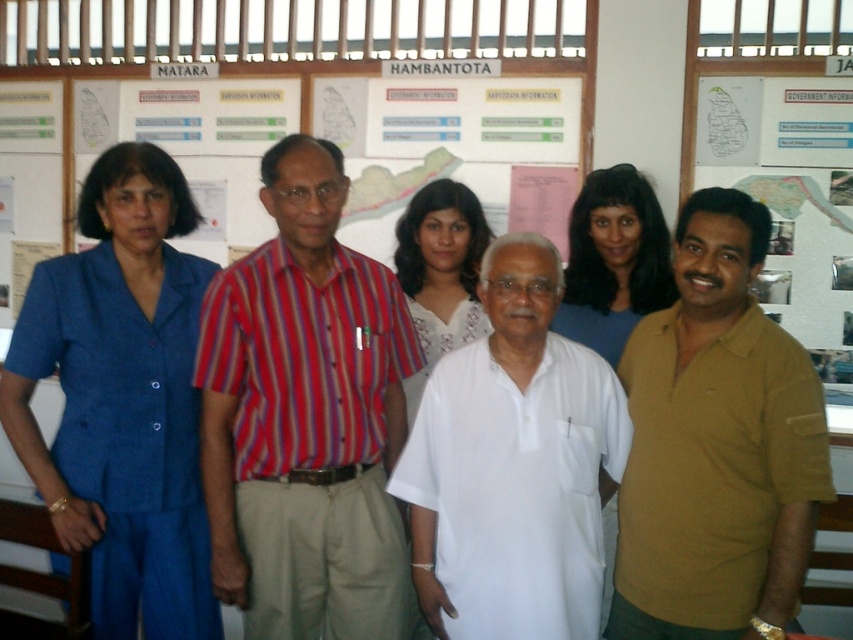
Is point (141, 614) farther from viewer compared to point (440, 189)?

No, it is not.

What do you see at coordinates (122, 397) in the screenshot? I see `blue fabric suit at left` at bounding box center [122, 397].

Who is more distant from viewer, (184, 524) or (426, 266)?

Point (426, 266)

Find the location of a particular element. blue fabric suit at left is located at coordinates (122, 397).

Which is below, striped cotton shirt at center or smooth blue blouse at center?

Positioned lower is striped cotton shirt at center.

Can you confirm if striped cotton shirt at center is positioned to the right of smooth blue blouse at center?

In fact, striped cotton shirt at center is to the left of smooth blue blouse at center.

Where is `striped cotton shirt at center`? Image resolution: width=853 pixels, height=640 pixels. striped cotton shirt at center is located at coordinates (306, 419).

Which is behind, point (827, 179) or point (433, 282)?

The point (827, 179) is more distant.

Does brown shirt at right appear on the right side of white lace dress at center?

Yes, brown shirt at right is to the right of white lace dress at center.

Is point (798, 129) behind point (419, 208)?

Yes, point (798, 129) is farther from viewer.

Image resolution: width=853 pixels, height=640 pixels. What are the coordinates of `brown shirt at right` in the screenshot? It's located at (791, 200).